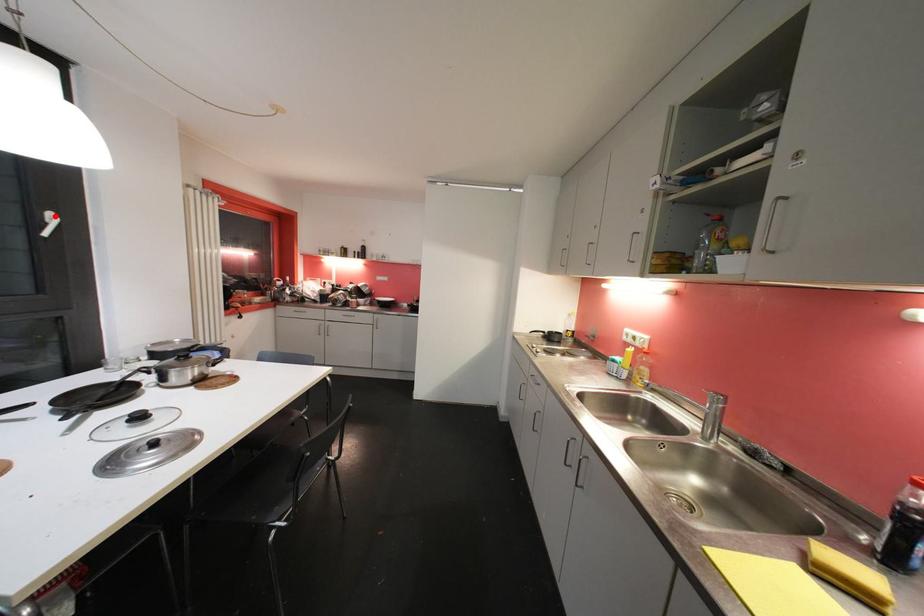
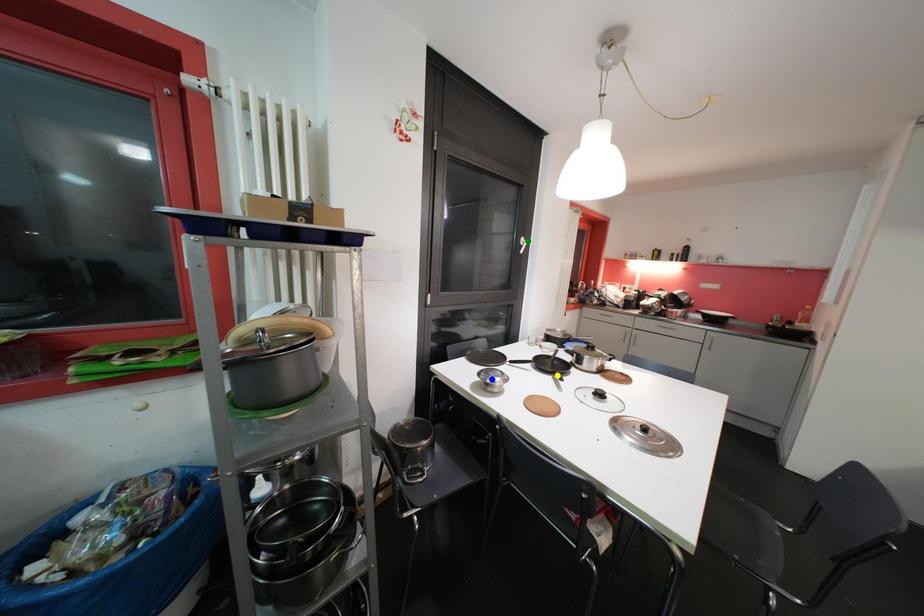
Question: I am providing you with two images of the same scene from different viewpoints. A red point is marked on the first image. You are given multiple points on the second image. Can you choose the point in image 2 that corresponds to the point in image 1?

Choices:
 (A) green point
 (B) blue point
 (C) yellow point

Answer: (A)